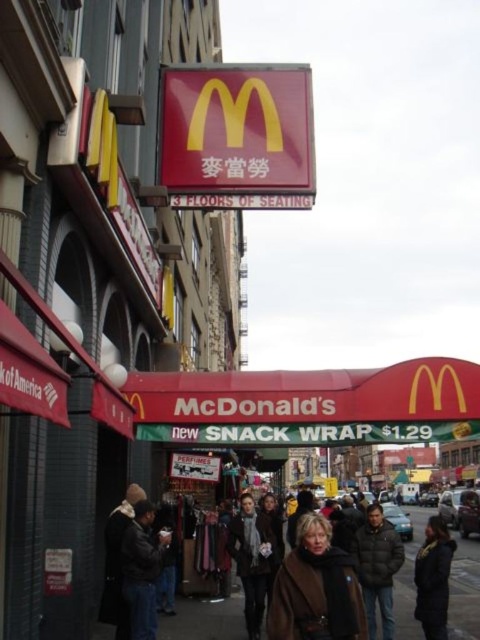
You are standing at the entrance of the McDonalds and want to reach the metallic silver sign at center. There is a person wearing a dark gray puffer jacket at center in your way. Can you walk straight ahead to reach the sign without going around them?

The dark gray puffer jacket at center is 27.67 meters away from the metallic silver sign at center. Since the jacket is between you and the sign, you would need to go around them as they are blocking the path.

You are standing on the sidewalk and see the dark gray puffer jacket at center and the metallic silver sign at center. Which object is closer to the ground?

The dark gray puffer jacket at center is closer to the ground because it is positioned below the metallic silver sign at center.

You are a photographer standing on the sidewalk taking pictures of the McDonalds entrance. You notice two people wearing jackets. The first person is wearing a brown leather jacket at lower center and the second is wearing a dark brown leather jacket at lower right. Which jacket is taller?

The brown leather jacket at lower center is much taller than the dark brown leather jacket at lower right.